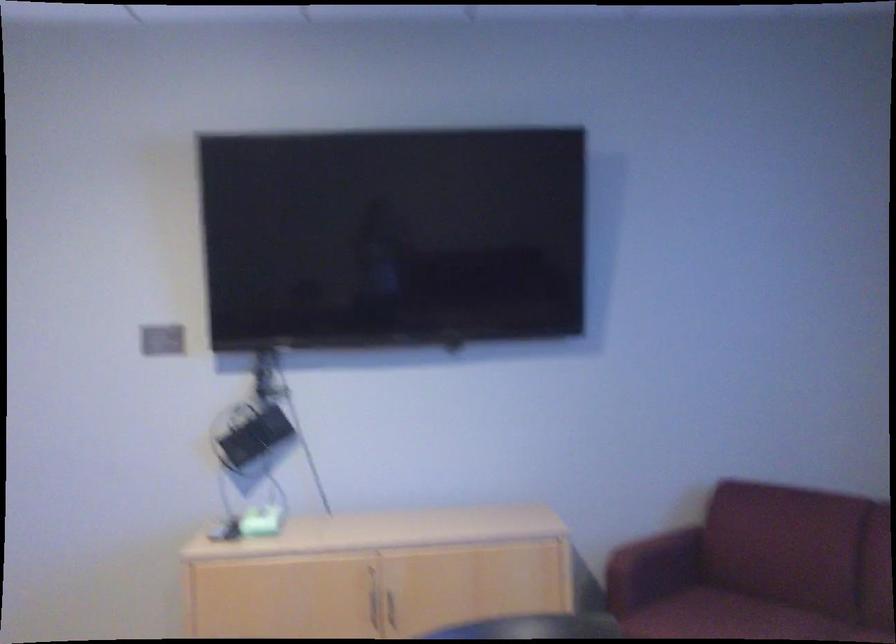
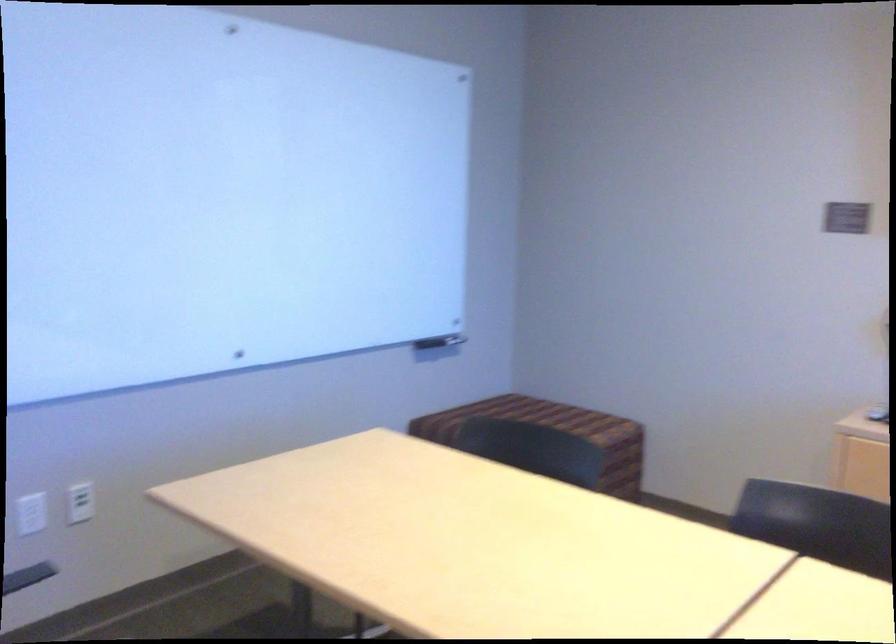
Question: The images are taken continuously from a first-person perspective. In which direction is your viewpoint rotating?

Choices:
 (A) Left
 (B) Right
 (C) Up
 (D) Down

Answer: (A)